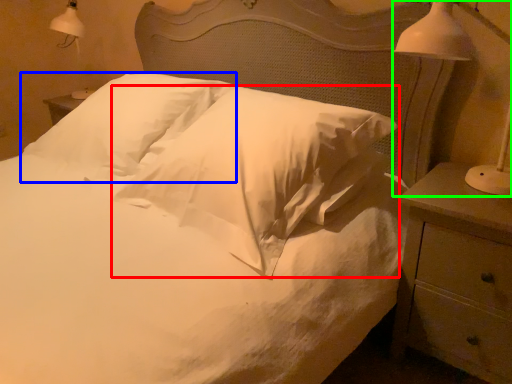
Question: Estimate the real-world distances between objects in this image. Which object is farther from pillow (highlighted by a red box), pillow (highlighted by a blue box) or bedside lamp (highlighted by a green box)?

Choices:
 (A) pillow
 (B) bedside lamp

Answer: (B)